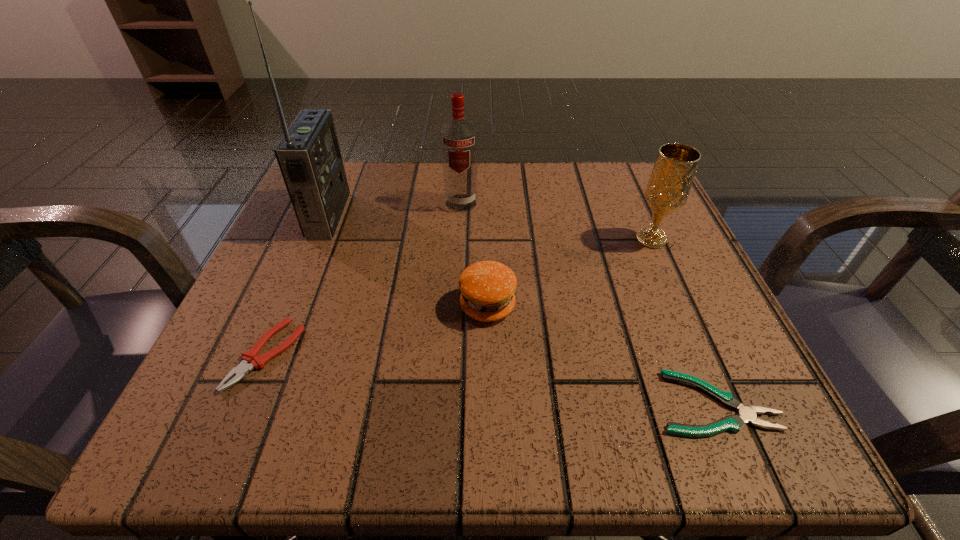
Identify the location of free space located 0.180m on the front of the third tallest object. The width and height of the screenshot is (960, 540). (691, 330).

Locate an element on the screen. Image resolution: width=960 pixels, height=540 pixels. vacant space located 0.220m on the back of the patty is located at coordinates 486,208.

You are a GUI agent. You are given a task and a screenshot of the screen. Output one action in this format:
    pyautogui.click(x=<x>, y=<y>)
    Task: Click on the vacant area located 0.350m on the back of the taller pliers
    This screenshot has width=960, height=540.
    Given the screenshot: What is the action you would take?
    pyautogui.click(x=335, y=193)

Where is `vacant area situated on the left of the shorter pliers`? vacant area situated on the left of the shorter pliers is located at coordinates (479, 403).

Locate an element on the screen. radio receiver that is positioned at the far edge is located at coordinates (308, 155).

Identify the location of vodka present at the far edge. This screenshot has height=540, width=960. (459, 138).

Identify the location of radio receiver located at the left edge. The image size is (960, 540). (308, 155).

Image resolution: width=960 pixels, height=540 pixels. I want to click on pliers that is positioned at the left edge, so click(x=250, y=359).

The height and width of the screenshot is (540, 960). I want to click on chalice that is at the right edge, so click(x=673, y=173).

This screenshot has width=960, height=540. In order to click on pliers located in the right edge section of the desktop in this screenshot , I will do `click(747, 414)`.